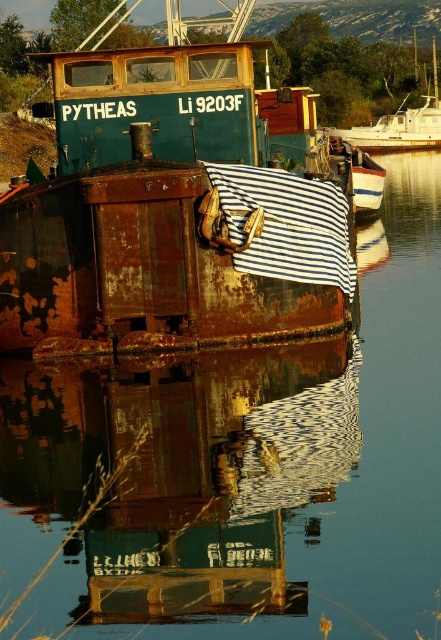
Looking at this image, does rusty metal boat at center appear on the left side of white glossy boat at right?

Indeed, rusty metal boat at center is positioned on the left side of white glossy boat at right.

Does rusty metal boat at center have a lesser width compared to white glossy boat at right?

Correct, rusty metal boat at center's width is less than white glossy boat at right's.

Does point (200, 234) lie behind point (385, 138)?

No, (200, 234) is closer to viewer.

Identify the location of rusty metal boat at center. (174, 209).

In the scene shown: Which is more to the right, rusty metal boat at lower center or rusty metal boat at center?

rusty metal boat at center is more to the right.

Between point (88, 380) and point (8, 346), which one is positioned in front?

Point (88, 380) is in front.

Who is more distant from viewer, (284, 396) or (104, 248)?

The point (104, 248) is more distant.

Where is `rusty metal boat at lower center`? The width and height of the screenshot is (441, 640). rusty metal boat at lower center is located at coordinates (189, 496).

Is rusty metal boat at lower center closer to camera compared to white glossy boat at right?

Yes.

Can you confirm if rusty metal boat at lower center is taller than white glossy boat at right?

In fact, rusty metal boat at lower center may be shorter than white glossy boat at right.

Does point (3, 396) come behind point (359, 138)?

No, (3, 396) is closer to viewer.

What are the coordinates of `rusty metal boat at lower center` in the screenshot? It's located at (189, 496).